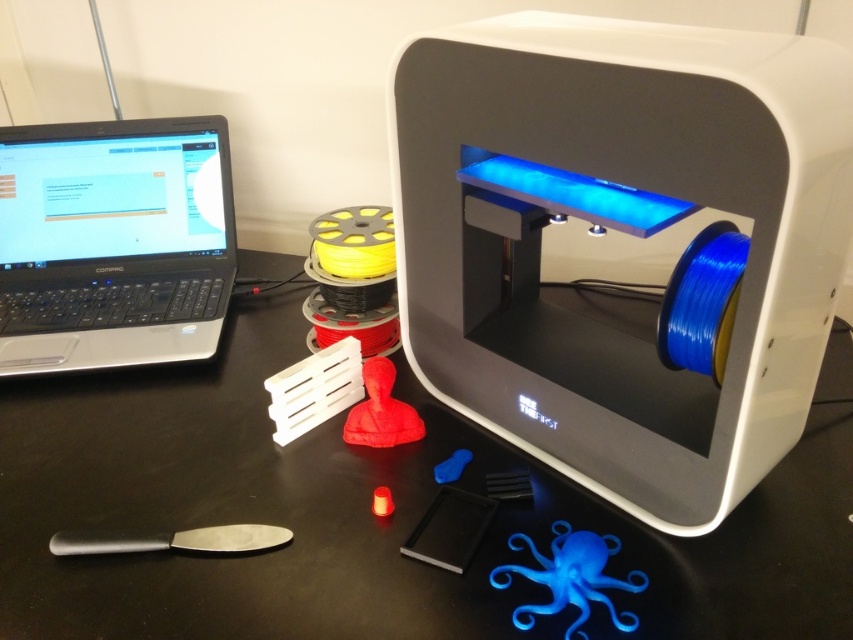
Question: Based on their relative distances, which object is nearer to the matte red bust at center?

Choices:
 (A) black matte spatula at lower left
 (B) black matte table at center

Answer: (A)

Question: Which of the following is the farthest from the observer?

Choices:
 (A) white plastic 3d printer at center
 (B) blue matte octopus at lower right

Answer: (B)

Question: Can you confirm if black matte table at center is positioned below blue matte octopus at lower right?

Choices:
 (A) no
 (B) yes

Answer: (A)

Question: Does black matte table at center have a larger size compared to silver/black plastic laptop at upper left?

Choices:
 (A) no
 (B) yes

Answer: (B)

Question: Is blue matte octopus at lower right to the right of black matte spatula at lower left from the viewer's perspective?

Choices:
 (A) yes
 (B) no

Answer: (A)

Question: Which object appears farthest from the camera in this image?

Choices:
 (A) matte red bust at center
 (B) silver/black plastic laptop at upper left
 (C) white plastic 3d printer at center
 (D) black matte spatula at lower left

Answer: (B)